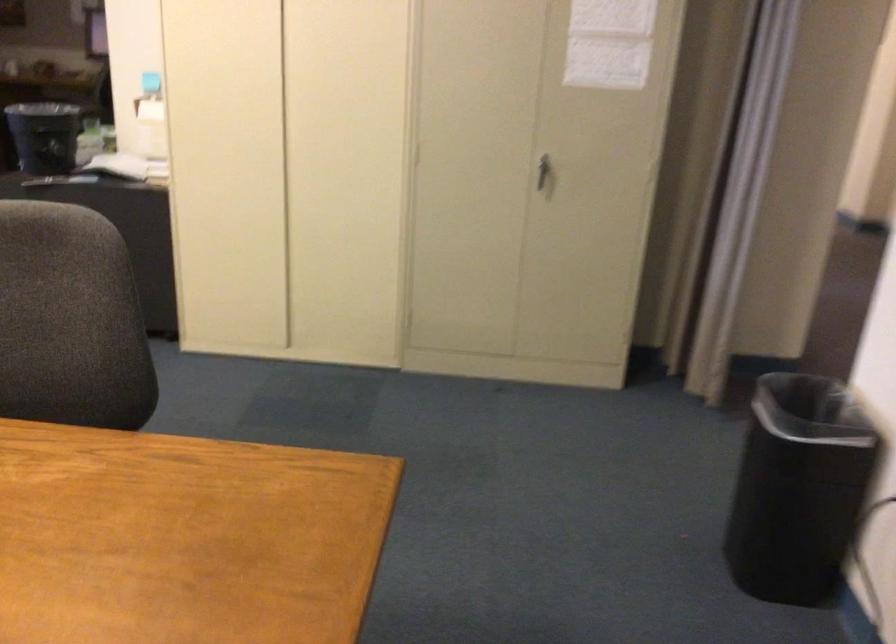
The height and width of the screenshot is (644, 896). What do you see at coordinates (544, 172) in the screenshot?
I see `a cabinet handle` at bounding box center [544, 172].